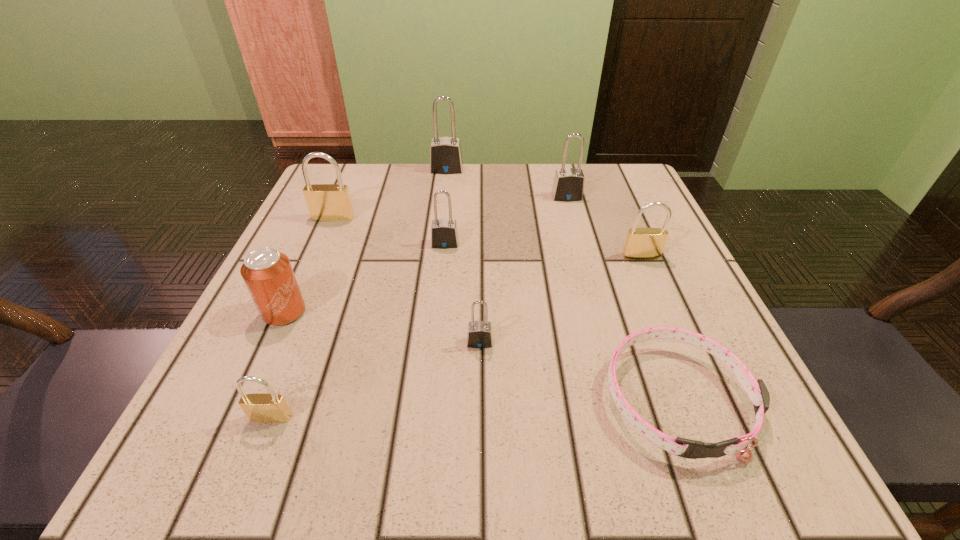
This screenshot has width=960, height=540. In order to click on orange can in this screenshot , I will do `click(268, 274)`.

The image size is (960, 540). I want to click on can, so click(x=268, y=274).

Locate an element on the screen. the fourth object from right to left is located at coordinates (479, 334).

The image size is (960, 540). What are the coordinates of `the nearest gray padlock` in the screenshot? It's located at (479, 334).

In order to click on the smallest brass padlock in this screenshot , I will do 262,407.

At what (x,y) coordinates should I click in order to perform the action: click on the nearest brass padlock. Please return your answer as a coordinate pair (x, y). This screenshot has height=540, width=960. Looking at the image, I should click on (262, 407).

You are a GUI agent. You are given a task and a screenshot of the screen. Output one action in this format:
    pyautogui.click(x=<x>, y=<y>)
    Task: Click on the shortest object
    This screenshot has height=540, width=960.
    Given the screenshot: What is the action you would take?
    pyautogui.click(x=756, y=390)

This screenshot has width=960, height=540. I want to click on dog collar, so click(756, 390).

The width and height of the screenshot is (960, 540). What are the coordinates of `free region located 0.370m on the shackle of the tallest padlock` in the screenshot? It's located at (435, 276).

What are the coordinates of `vacant space located on the shackle of the sixth padlock from left to right` in the screenshot? It's located at (587, 269).